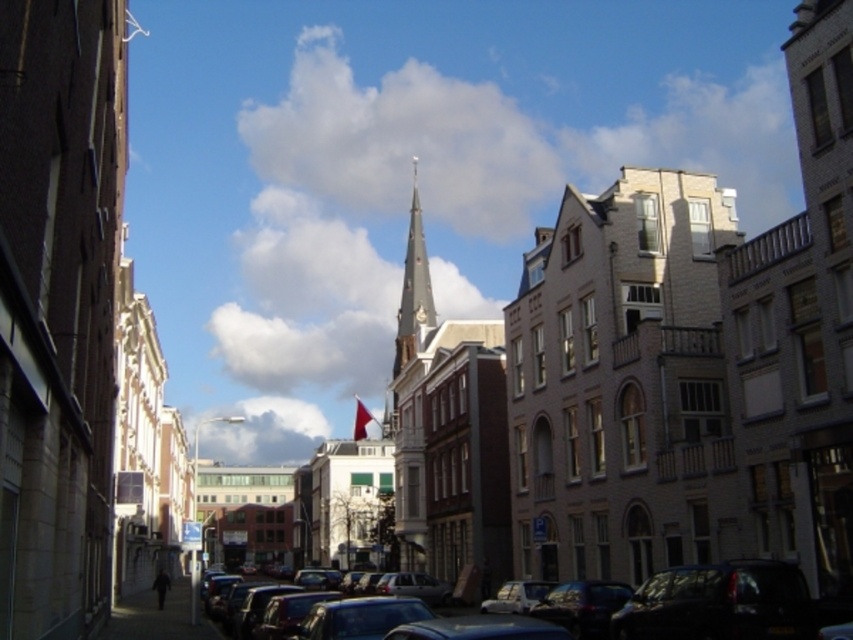
Question: Is shiny black car at center bigger than dark gray asphalt at lower center?

Choices:
 (A) no
 (B) yes

Answer: (A)

Question: Which object is closer to the camera taking this photo?

Choices:
 (A) dark gray asphalt at lower center
 (B) shiny black car at center

Answer: (B)

Question: Which point is closer to the camera taking this photo?

Choices:
 (A) (422, 307)
 (B) (724, 561)

Answer: (B)

Question: Where is shiny black car at center located in relation to red fabric flag at center in the image?

Choices:
 (A) left
 (B) right

Answer: (B)

Question: Can you confirm if light beige stone church at center is wider than dark gray asphalt at lower center?

Choices:
 (A) no
 (B) yes

Answer: (A)

Question: Among these objects, which one is farthest from the camera?

Choices:
 (A) red fabric flag at center
 (B) shiny black car at center

Answer: (A)